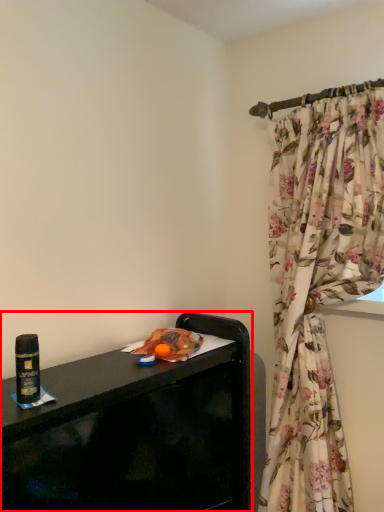
Question: From the image's perspective, where is furniture (annotated by the red box) located relative to beverage?

Choices:
 (A) below
 (B) above

Answer: (A)